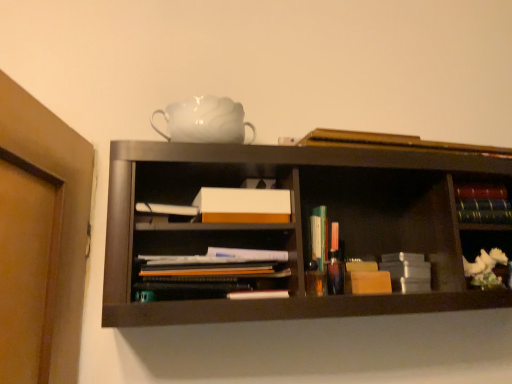
What do you see at coordinates (483, 203) in the screenshot? The width and height of the screenshot is (512, 384). I see `multicolored hardcover books at right, which is the 3th book in bottom-to-top order` at bounding box center [483, 203].

Image resolution: width=512 pixels, height=384 pixels. In order to click on white glossy teapot at upper center in this screenshot , I will do `click(205, 121)`.

What is the approximate width of white matte box at center?

The width of white matte box at center is 10.88 centimeters.

Image resolution: width=512 pixels, height=384 pixels. What do you see at coordinates (211, 262) in the screenshot?
I see `matte paper documents at center` at bounding box center [211, 262].

Image resolution: width=512 pixels, height=384 pixels. I want to click on matte paper documents at center, so click(x=211, y=262).

What are the coordinates of `white ceramic flower at right` in the screenshot? It's located at (485, 268).

The image size is (512, 384). I want to click on multicolored hardcover books at right, the 2th book from the top, so click(x=483, y=203).

Is white ceramic flower at right not near translucent plastic books at center, the first book in the bottom-to-top sequence?

No, white ceramic flower at right is in close proximity to translucent plastic books at center, the first book in the bottom-to-top sequence.

Considering the sizes of white ceramic flower at right and translucent plastic books at center, which appears as the 4th book when viewed from the top, in the image, is white ceramic flower at right taller or shorter than translucent plastic books at center, which appears as the 4th book when viewed from the top,?

In the image, white ceramic flower at right appears to be shorter than translucent plastic books at center, which appears as the 4th book when viewed from the top.

From a real-world perspective, which book is the 1st one above the white ceramic flower at right? Please provide its 2D coordinates.

[(319, 236)]

Is white ceramic flower at right situated inside translucent plastic books at center, the first book in the bottom-to-top sequence, or outside?

The correct answer is: outside.

How much distance is there between white glossy teapot at upper center and hardcover book at upper center, the fourth book ordered from the bottom?

white glossy teapot at upper center is 13.64 inches away from hardcover book at upper center, the fourth book ordered from the bottom.

Does point (180, 126) appear closer or farther from the camera than point (312, 137)?

Point (180, 126) is closer to the camera than point (312, 137).

How different are the orientations of white glossy teapot at upper center and hardcover book at upper center, the fourth book ordered from the bottom, in degrees?

They differ by 3.97 degrees in their facing directions.

Can you confirm if white glossy teapot at upper center is bigger than hardcover book at upper center, the first book from the top?

Yes.

Would you say translucent plastic books at center, which appears as the 4th book when viewed from the top, is part of hardcover books at right, positioned as the 3th book in top-to-bottom order,'s contents?

No, translucent plastic books at center, which appears as the 4th book when viewed from the top, is located outside of hardcover books at right, positioned as the 3th book in top-to-bottom order.

Looking at this image, how distant is hardcover books at right, positioned as the 2th book in bottom-to-top order, from translucent plastic books at center, the first book in the bottom-to-top sequence?

hardcover books at right, positioned as the 2th book in bottom-to-top order, is 43.28 centimeters away from translucent plastic books at center, the first book in the bottom-to-top sequence.

Between point (507, 222) and point (313, 233), which one is positioned in front?

The point (313, 233) is closer to the camera.

Consider the image. From their relative heights in the image, would you say hardcover books at right, positioned as the 3th book in top-to-bottom order, is taller or shorter than translucent plastic books at center, which appears as the 4th book when viewed from the top?

hardcover books at right, positioned as the 3th book in top-to-bottom order, is shorter than translucent plastic books at center, which appears as the 4th book when viewed from the top.

Could matte paper documents at center be considered to be inside translucent plastic books at center, the first book in the bottom-to-top sequence?

Actually, matte paper documents at center is outside translucent plastic books at center, the first book in the bottom-to-top sequence.

Can you confirm if translucent plastic books at center, which appears as the 4th book when viewed from the top, is positioned to the right of matte paper documents at center?

Correct, you'll find translucent plastic books at center, which appears as the 4th book when viewed from the top, to the right of matte paper documents at center.

From a real-world perspective, between translucent plastic books at center, the first book in the bottom-to-top sequence, and matte paper documents at center, who is vertically lower?

matte paper documents at center is physically lower.

From the image's perspective, which is above, translucent plastic books at center, which appears as the 4th book when viewed from the top, or matte paper documents at center?

translucent plastic books at center, which appears as the 4th book when viewed from the top.

Is white glossy teapot at upper center taller or shorter than matte paper documents at center?

white glossy teapot at upper center is taller than matte paper documents at center.

Where is `teapot that is on the left side of matte paper documents at center`? This screenshot has width=512, height=384. teapot that is on the left side of matte paper documents at center is located at coordinates (205, 121).

From a real-world perspective, which object stands above the other?

In real-world perspective, white glossy teapot at upper center is above.

Who is bigger, white glossy teapot at upper center or matte paper documents at center?

matte paper documents at center.

How far apart are matte paper documents at center and white matte box at center?

matte paper documents at center is 3.23 inches from white matte box at center.

Is matte paper documents at center in contact with white matte box at center?

Yes, matte paper documents at center is next to white matte box at center.

Can you confirm if matte paper documents at center is smaller than white matte box at center?

No.

Find the location of a particular element. cabinet above the matte paper documents at center (from the image's perspective) is located at coordinates (214, 224).

Would you say white matte box at center is outside white glossy teapot at upper center?

white matte box at center lies outside white glossy teapot at upper center's area.

Can you confirm if white matte box at center is bigger than white glossy teapot at upper center?

Actually, white matte box at center might be smaller than white glossy teapot at upper center.

Considering their positions, is white matte box at center located in front of or behind white glossy teapot at upper center?

white matte box at center is in front of white glossy teapot at upper center.

Does white matte box at center turn towards white glossy teapot at upper center?

No, white matte box at center does not turn towards white glossy teapot at upper center.

I want to click on flower directly beneath the translucent plastic books at center, which appears as the 4th book when viewed from the top (from a real-world perspective), so click(x=485, y=268).

Image resolution: width=512 pixels, height=384 pixels. Find the location of `teapot above the hardcover book at upper center, the first book from the top (from a real-world perspective)`. teapot above the hardcover book at upper center, the first book from the top (from a real-world perspective) is located at coordinates (205, 121).

When comparing their distances from white ceramic flower at right, does white glossy teapot at upper center or hardcover books at right, positioned as the 3th book in top-to-bottom order, seem closer?

Based on the image, hardcover books at right, positioned as the 3th book in top-to-bottom order, appears to be nearer to white ceramic flower at right.

Considering their positions, is multicolored hardcover books at right, the 2th book from the top, positioned further to white glossy teapot at upper center than hardcover book at upper center, the first book from the top?

Based on the image, multicolored hardcover books at right, the 2th book from the top, appears to be further to white glossy teapot at upper center.

Estimate the real-world distances between objects in this image. Which object is further from hardcover books at right, positioned as the 3th book in top-to-bottom order, white glossy teapot at upper center or white matte box at center?

The object further to hardcover books at right, positioned as the 3th book in top-to-bottom order, is white glossy teapot at upper center.

Considering their positions, is hardcover books at right, positioned as the 2th book in bottom-to-top order, positioned closer to white glossy teapot at upper center than hardcover book at upper center, the first book from the top?

The object closer to white glossy teapot at upper center is hardcover book at upper center, the first book from the top.

Estimate the real-world distances between objects in this image. Which object is further from translucent plastic books at center, which appears as the 4th book when viewed from the top, hardcover book at upper center, the fourth book ordered from the bottom, or matte paper documents at center?

hardcover book at upper center, the fourth book ordered from the bottom, is further to translucent plastic books at center, which appears as the 4th book when viewed from the top.

Based on their spatial positions, is hardcover book at upper center, the first book from the top, or multicolored hardcover books at right, which is the 3th book in bottom-to-top order, further from matte paper documents at center?

multicolored hardcover books at right, which is the 3th book in bottom-to-top order.

Considering their positions, is hardcover books at right, positioned as the 2th book in bottom-to-top order, positioned further to multicolored hardcover books at right, which is the 3th book in bottom-to-top order, than translucent plastic books at center, which appears as the 4th book when viewed from the top?

translucent plastic books at center, which appears as the 4th book when viewed from the top.

When comparing their distances from multicolored hardcover books at right, which is the 3th book in bottom-to-top order, does hardcover book at upper center, the fourth book ordered from the bottom, or white matte box at center seem further?

white matte box at center.

Identify the location of cabinet located between white glossy teapot at upper center and multicolored hardcover books at right, which is the 3th book in bottom-to-top order, in the left-right direction. (214, 224).

Where is `shelf between white matte box at center and hardcover books at right, positioned as the 3th book in top-to-bottom order, in the horizontal direction`? The image size is (512, 384). shelf between white matte box at center and hardcover books at right, positioned as the 3th book in top-to-bottom order, in the horizontal direction is located at coordinates (211, 262).

You are a GUI agent. You are given a task and a screenshot of the screen. Output one action in this format:
    pyautogui.click(x=<x>, y=<y>)
    Task: Click on the cabinet situated between white glossy teapot at upper center and hardcover books at right, positioned as the 2th book in bottom-to-top order, from left to right
    The image size is (512, 384).
    Given the screenshot: What is the action you would take?
    pyautogui.click(x=214, y=224)

Identify the location of book between hardcover book at upper center, the first book from the top, and hardcover books at right, positioned as the 2th book in bottom-to-top order. (483, 203).